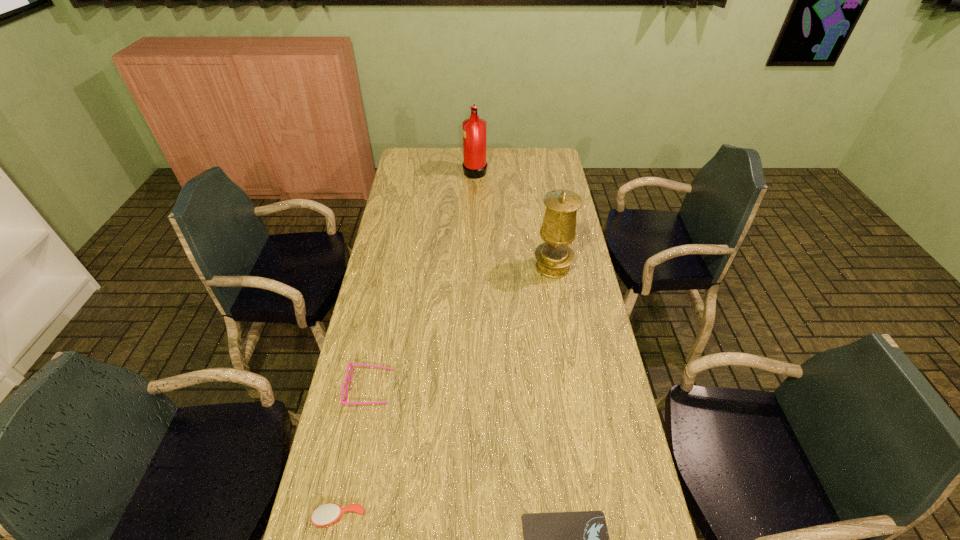
The width and height of the screenshot is (960, 540). In order to click on free spot that satisfies the following two spatial constraints: 1. at the spray nozzle of the farthest object; 2. on the back side of the fourth nearest object in this screenshot , I will do `click(473, 267)`.